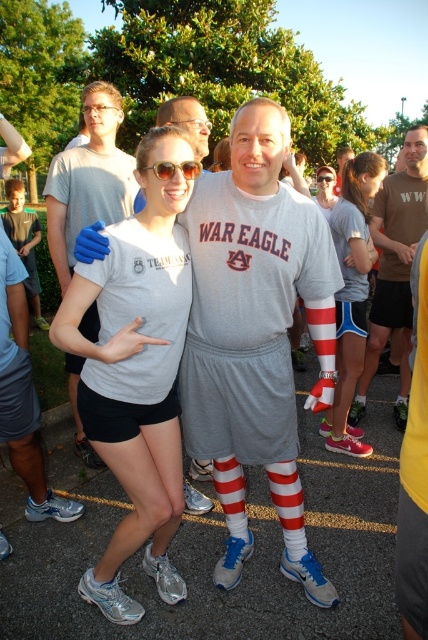
You are taking a photo of two people in the scene. The first person is pointing at a point labeled as point (234, 168), and the second person is pointing at point (345, 440). Which point is closer to the camera?

Point (234, 168) is closer to the camera than point (345, 440).